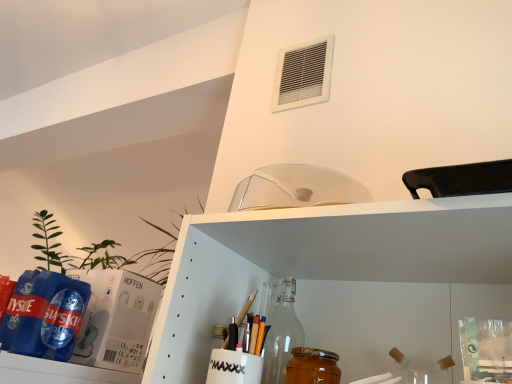
Question: Is golden honey jar at lower center closer to the viewer compared to white plastic air conditioning at upper center?

Choices:
 (A) yes
 (B) no

Answer: (A)

Question: Is golden honey jar at lower center bigger than white plastic air conditioning at upper center?

Choices:
 (A) no
 (B) yes

Answer: (A)

Question: Is golden honey jar at lower center wider than white plastic air conditioning at upper center?

Choices:
 (A) no
 (B) yes

Answer: (B)

Question: Considering the relative sizes of golden honey jar at lower center and white plastic air conditioning at upper center in the image provided, is golden honey jar at lower center smaller than white plastic air conditioning at upper center?

Choices:
 (A) no
 (B) yes

Answer: (B)

Question: From the image's perspective, is golden honey jar at lower center over white plastic air conditioning at upper center?

Choices:
 (A) no
 (B) yes

Answer: (A)

Question: Is golden honey jar at lower center surrounding white plastic air conditioning at upper center?

Choices:
 (A) yes
 (B) no

Answer: (B)

Question: From a real-world perspective, is white plastic air conditioning at upper center beneath golden honey jar at lower center?

Choices:
 (A) no
 (B) yes

Answer: (A)

Question: From a real-world perspective, is white plastic air conditioning at upper center over golden honey jar at lower center?

Choices:
 (A) no
 (B) yes

Answer: (B)

Question: From the image's perspective, is white plastic air conditioning at upper center above golden honey jar at lower center?

Choices:
 (A) yes
 (B) no

Answer: (A)

Question: Is white plastic air conditioning at upper center far from golden honey jar at lower center?

Choices:
 (A) yes
 (B) no

Answer: (B)

Question: Is white plastic air conditioning at upper center outside golden honey jar at lower center?

Choices:
 (A) no
 (B) yes

Answer: (B)

Question: Can you confirm if white plastic air conditioning at upper center is thinner than golden honey jar at lower center?

Choices:
 (A) yes
 (B) no

Answer: (A)

Question: From a real-world perspective, is white plastic air conditioning at upper center above or below golden honey jar at lower center?

Choices:
 (A) below
 (B) above

Answer: (B)